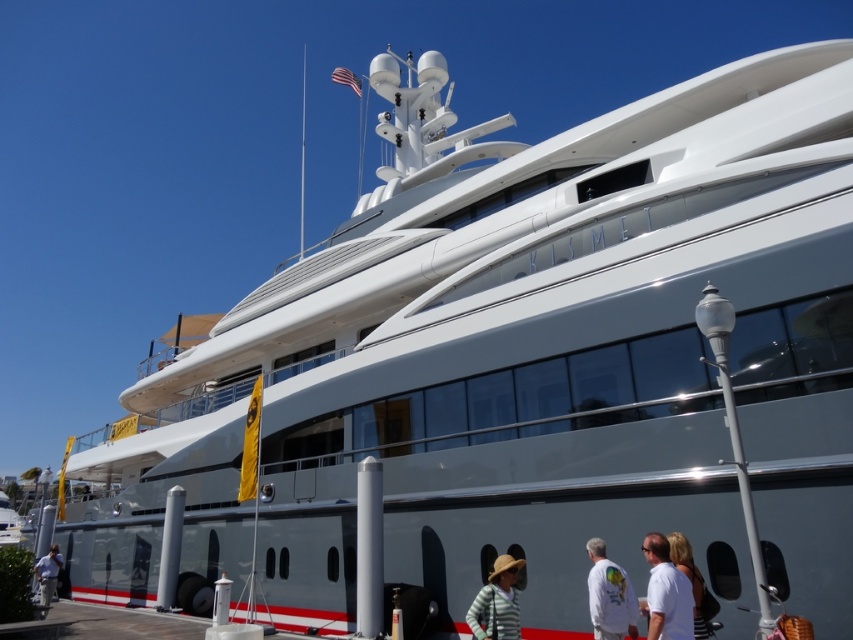
Does white matte shirt at lower right have a greater width compared to light blue shirt at lower left?

No.

Does point (675, 600) come behind point (36, 573)?

No, it is in front of (36, 573).

Which is behind, point (682, 573) or point (57, 564)?

Positioned behind is point (57, 564).

Identify the location of white matte shirt at lower right. (666, 593).

Is point (611, 612) closer to viewer compared to point (35, 563)?

Yes, point (611, 612) is closer to viewer.

How distant is white cotton shirt at lower right from light blue shirt at lower left?

white cotton shirt at lower right and light blue shirt at lower left are 86.06 feet apart.

Does point (630, 620) lie behind point (55, 547)?

No, (630, 620) is closer to viewer.

You are a GUI agent. You are given a task and a screenshot of the screen. Output one action in this format:
    pyautogui.click(x=<x>, y=<y>)
    Task: Click on the white cotton shirt at lower right
    Image resolution: width=853 pixels, height=640 pixels.
    Given the screenshot: What is the action you would take?
    pos(608,595)

Does blonde hair at lower right have a smaller size compared to light blue shirt at lower left?

Indeed, blonde hair at lower right has a smaller size compared to light blue shirt at lower left.

From the picture: Who is more forward, (697, 637) or (35, 577)?

Point (697, 637)

Where is `blonde hair at lower right`? blonde hair at lower right is located at coordinates [x=689, y=579].